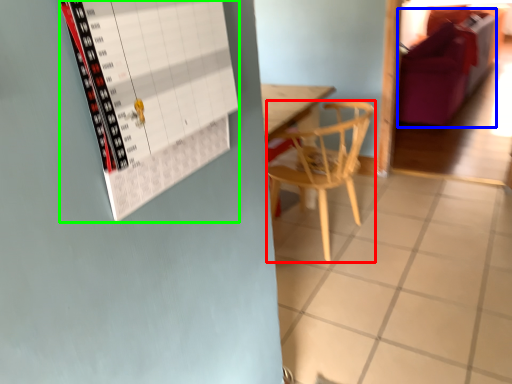
Question: Which is farther away from chair (highlighted by a red box)? couch (highlighted by a blue box) or bulletin board (highlighted by a green box)?

Choices:
 (A) couch
 (B) bulletin board

Answer: (A)